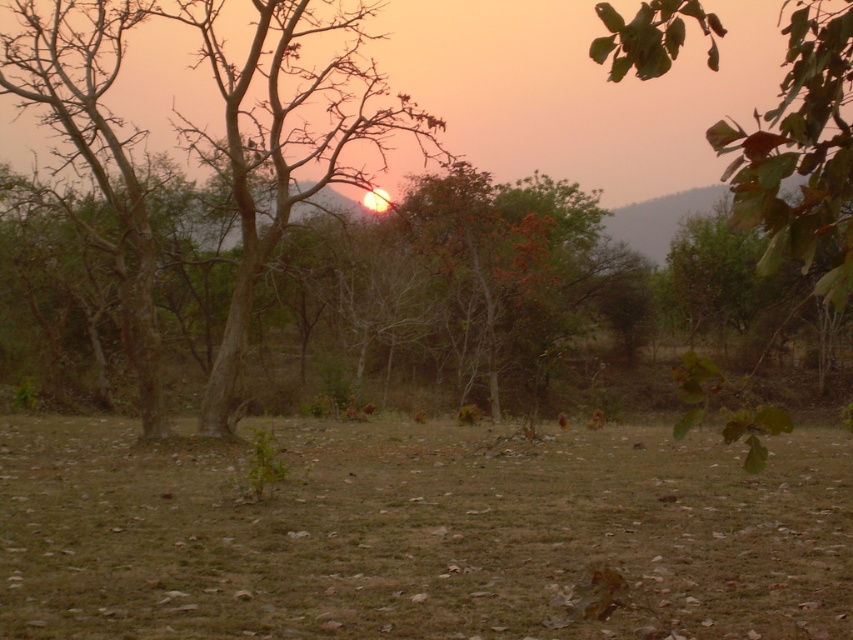
Question: In this image, where is brown grass at center located relative to brown/dry wood tree at center?

Choices:
 (A) below
 (B) above

Answer: (A)

Question: Among these points, which one is farthest from the camera?

Choices:
 (A) (751, 211)
 (B) (329, 563)

Answer: (B)

Question: Among these objects, which one is nearest to the camera?

Choices:
 (A) brown/dry wood tree at center
 (B) brown grass at center

Answer: (A)

Question: Is the position of brown grass at center less distant than that of brown/dry wood tree at center?

Choices:
 (A) no
 (B) yes

Answer: (A)

Question: Is brown grass at center positioned behind brown/dry wood tree at center?

Choices:
 (A) no
 (B) yes

Answer: (B)